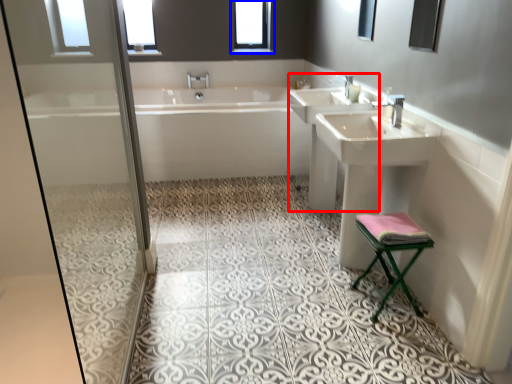
Question: Which of the following is the closest to the observer, sink (highlighted by a red box) or window (highlighted by a blue box)?

Choices:
 (A) sink
 (B) window

Answer: (A)